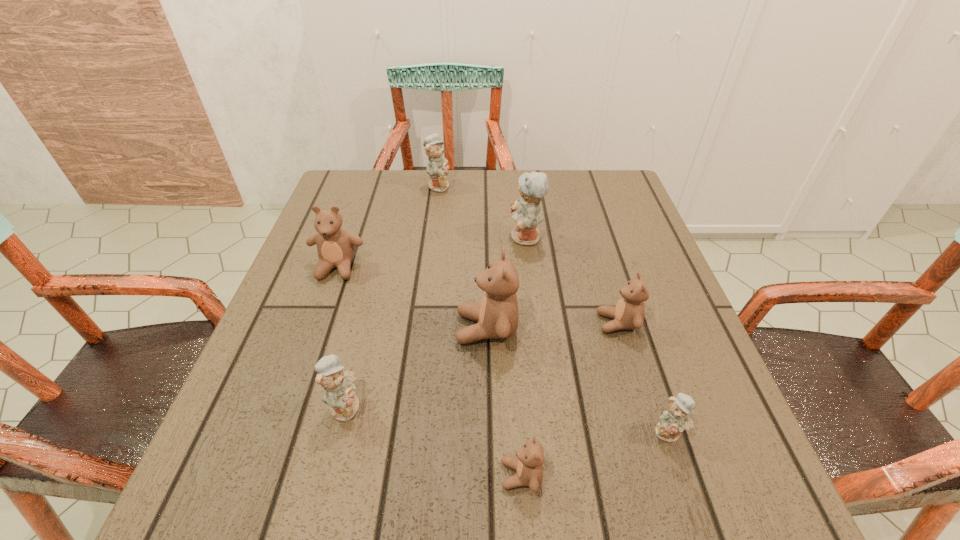
The height and width of the screenshot is (540, 960). I want to click on the second farthest object, so click(526, 211).

Where is `the third blue teddy bear from left to right`? the third blue teddy bear from left to right is located at coordinates (526, 211).

The width and height of the screenshot is (960, 540). I want to click on the biggest brown teddy bear, so click(x=497, y=315).

Find the location of a particular element. This screenshot has width=960, height=540. the second biggest blue teddy bear is located at coordinates (437, 168).

You are a GUI agent. You are given a task and a screenshot of the screen. Output one action in this format:
    pyautogui.click(x=<x>, y=<y>)
    Task: Click on the farthest blue teddy bear
    The height and width of the screenshot is (540, 960).
    Given the screenshot: What is the action you would take?
    pyautogui.click(x=437, y=168)

Identify the location of the leftmost teddy bear. Image resolution: width=960 pixels, height=540 pixels. (335, 246).

You are a GUI agent. You are given a task and a screenshot of the screen. Output one action in this format:
    pyautogui.click(x=<x>, y=<y>)
    Task: Click on the second biggest brown teddy bear
    
    Given the screenshot: What is the action you would take?
    pyautogui.click(x=335, y=246)

Image resolution: width=960 pixels, height=540 pixels. What are the coordinates of `the second object from left to right` in the screenshot? It's located at (338, 385).

Where is `the seventh teddy bear from right to left`? The height and width of the screenshot is (540, 960). the seventh teddy bear from right to left is located at coordinates (338, 385).

The height and width of the screenshot is (540, 960). Identify the location of the third biggest brown teddy bear. (629, 313).